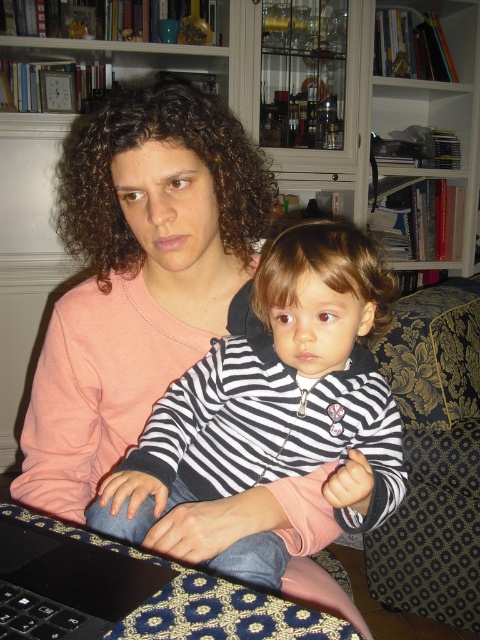
Question: Does pink matte sweater at center have a larger size compared to black rubberized keyboard at lower left?

Choices:
 (A) no
 (B) yes

Answer: (B)

Question: Which point is farther to the camera?

Choices:
 (A) (279, 284)
 (B) (0, 557)

Answer: (A)

Question: Observing the image, what is the correct spatial positioning of wooden bookshelf at upper center in reference to black matte laptop at lower left?

Choices:
 (A) right
 (B) left

Answer: (A)

Question: Which object is farther from the camera taking this photo?

Choices:
 (A) striped fabric baby at center
 (B) black matte laptop at lower left

Answer: (A)

Question: Is striped fabric baby at center to the left of black rubberized keyboard at lower left from the viewer's perspective?

Choices:
 (A) no
 (B) yes

Answer: (A)

Question: Among these points, which one is nearest to the camera?

Choices:
 (A) (240, 340)
 (B) (22, 618)
 (C) (9, 582)

Answer: (B)